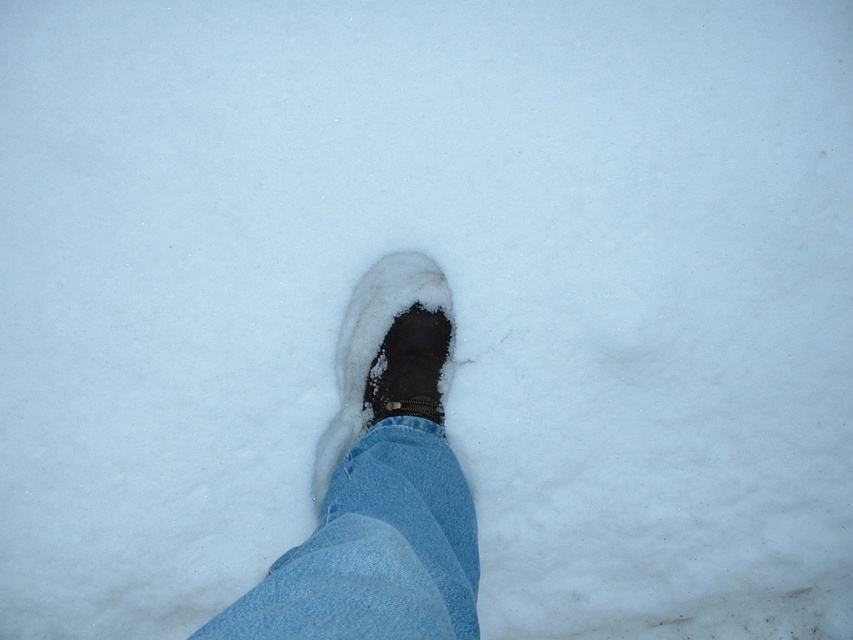
Question: Among these points, which one is nearest to the camera?

Choices:
 (A) (370, 396)
 (B) (410, 576)

Answer: (B)

Question: Observing the image, what is the correct spatial positioning of denim at center in reference to brown suede boot at center?

Choices:
 (A) below
 (B) above

Answer: (A)

Question: Is denim at center above brown suede boot at center?

Choices:
 (A) yes
 (B) no

Answer: (B)

Question: Which of the following is the farthest from the observer?

Choices:
 (A) (373, 577)
 (B) (451, 339)

Answer: (B)

Question: From the image, what is the correct spatial relationship of denim at center in relation to brown suede boot at center?

Choices:
 (A) above
 (B) below

Answer: (B)